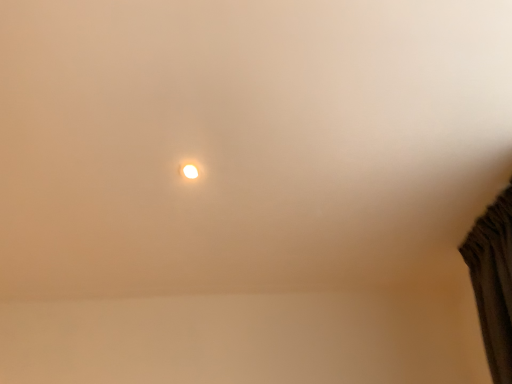
Question: Should I look upward or downward to see matte white droplight at upper center?

Choices:
 (A) up
 (B) down

Answer: (A)